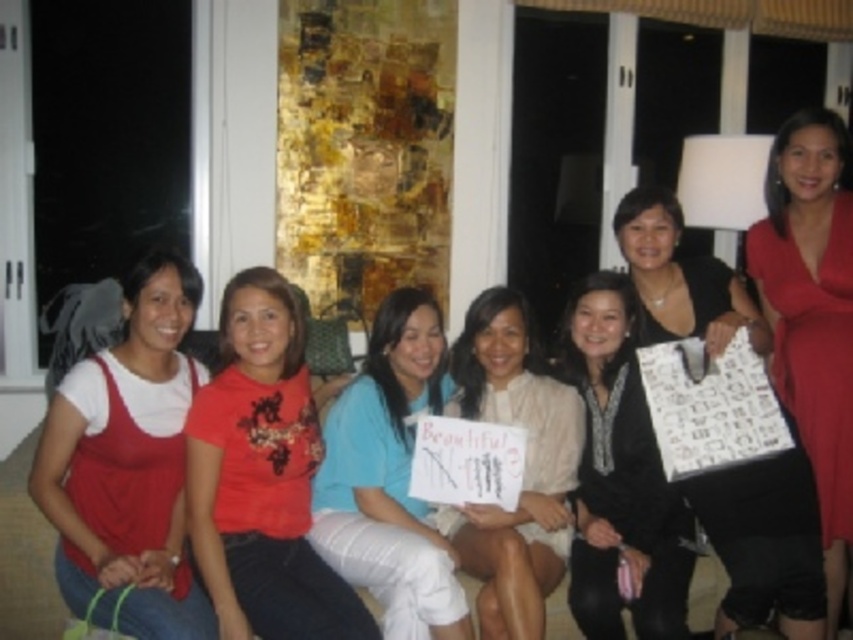
Question: Which of the following is the farthest from the observer?

Choices:
 (A) (614, 300)
 (B) (500, 413)
 (C) (123, 358)
 (D) (784, 204)

Answer: (B)

Question: Which object is positioned farthest from the matte red tank top at left?

Choices:
 (A) matte red dress at right
 (B) black satin dress at center
 (C) white matte sign at center
 (D) red matte shirt at center

Answer: (A)

Question: Is red matte shirt at center to the left of matte blue shirt at center from the viewer's perspective?

Choices:
 (A) yes
 (B) no

Answer: (A)

Question: Considering the relative positions of black satin dress at center and white matte sign at center in the image provided, where is black satin dress at center located with respect to white matte sign at center?

Choices:
 (A) right
 (B) left

Answer: (A)

Question: Can you confirm if matte red tank top at left is positioned to the left of matte red dress at right?

Choices:
 (A) yes
 (B) no

Answer: (A)

Question: Which of the following is the closest to the observer?

Choices:
 (A) black matte bag at center
 (B) red matte shirt at center
 (C) black satin dress at center

Answer: (B)